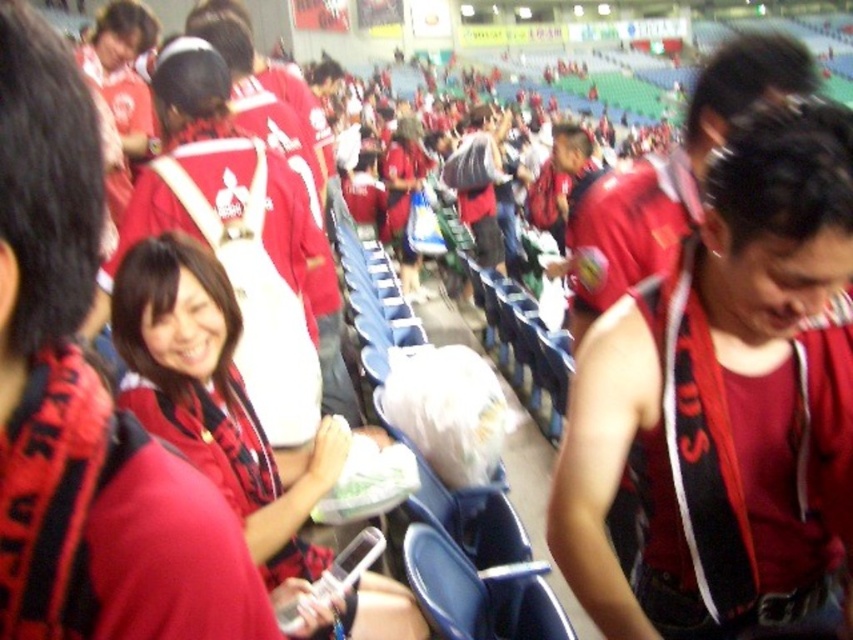
Which is above, matte red shirt at center or matte red jersey at center?

matte red jersey at center

Between matte red shirt at center and matte red jersey at center, which one appears on the right side from the viewer's perspective?

matte red jersey at center

Identify the location of matte red shirt at center. (724, 401).

Identify the location of matte red shirt at center. This screenshot has width=853, height=640. (724, 401).

Is the position of matte red jacket at center more distant than that of matte red jersey at center?

No, matte red jacket at center is in front of matte red jersey at center.

Does matte red jacket at center appear on the left side of matte red jersey at center?

Correct, you'll find matte red jacket at center to the left of matte red jersey at center.

Locate an element on the screen. Image resolution: width=853 pixels, height=640 pixels. matte red jacket at center is located at coordinates (213, 397).

Does matte red shirt at center appear on the right side of matte red jacket at center?

Yes, matte red shirt at center is to the right of matte red jacket at center.

Who is more distant from viewer, [671,355] or [294,531]?

Point [294,531]

The width and height of the screenshot is (853, 640). I want to click on matte red shirt at center, so pyautogui.click(x=724, y=401).